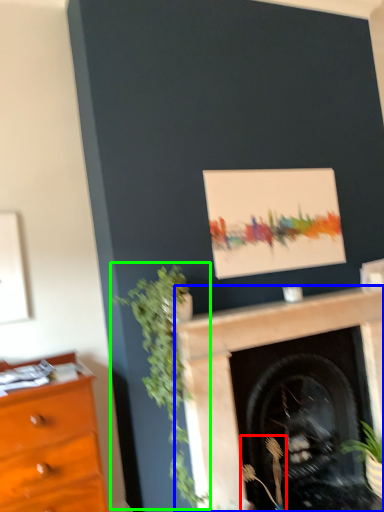
Question: Which object is positioned farthest from plant (highlighted by a red box)? Select from fireplace (highlighted by a blue box) and plant (highlighted by a green box).

Choices:
 (A) fireplace
 (B) plant

Answer: (B)